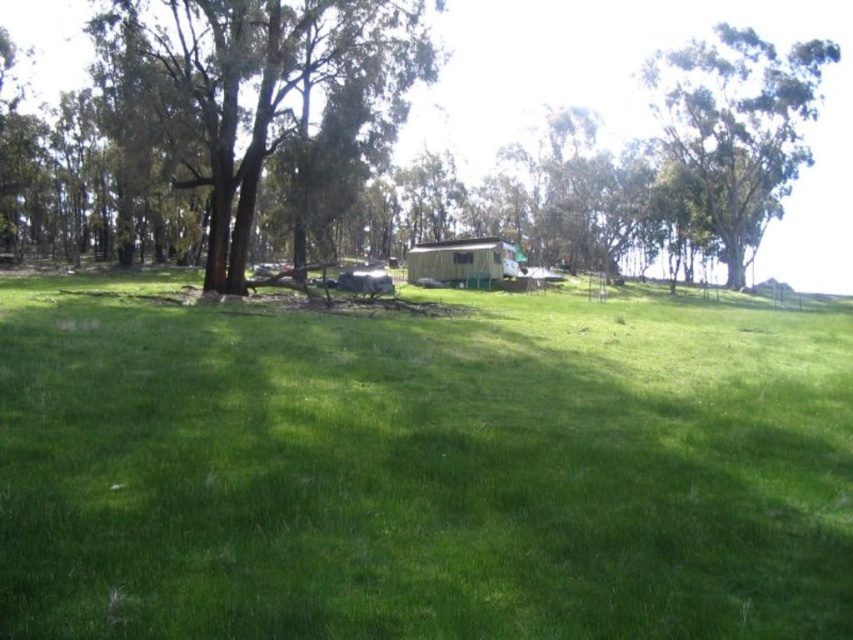
Can you confirm if green grassy field at center is positioned to the left of green leafy tree at upper right?

Correct, you'll find green grassy field at center to the left of green leafy tree at upper right.

Can you confirm if green grassy field at center is bigger than green leafy tree at upper right?

Actually, green grassy field at center might be smaller than green leafy tree at upper right.

Is point (102, 518) closer to camera compared to point (682, 113)?

Yes, it is in front of point (682, 113).

Image resolution: width=853 pixels, height=640 pixels. In order to click on green grassy field at center in this screenshot , I will do 421,468.

Can you confirm if green grassy field at center is shorter than brown textured tree at center?

Correct, green grassy field at center is not as tall as brown textured tree at center.

Between green grassy field at center and brown textured tree at center, which one has less height?

green grassy field at center

Which is behind, point (141, 545) or point (701, 24)?

Positioned behind is point (701, 24).

The image size is (853, 640). I want to click on green grassy field at center, so coord(421,468).

Looking at this image, which is more to the left, green grassy field at center or white plastic hut at center?

From the viewer's perspective, green grassy field at center appears more on the left side.

Who is higher up, green grassy field at center or white plastic hut at center?

Positioned higher is white plastic hut at center.

Between point (796, 401) and point (436, 257), which one is positioned behind?

Point (436, 257)

The image size is (853, 640). Identify the location of green grassy field at center. (421, 468).